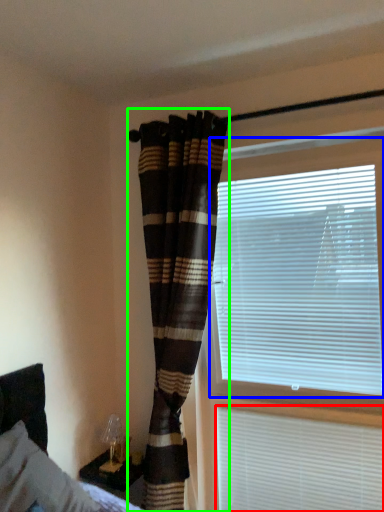
Question: Which is farther away from window blind (highlighted by a red box)? window blind (highlighted by a blue box) or curtain (highlighted by a green box)?

Choices:
 (A) window blind
 (B) curtain

Answer: (B)